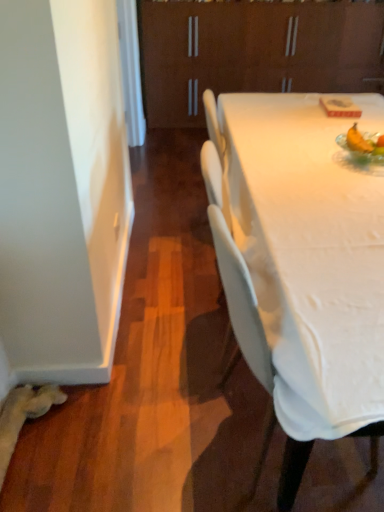
Question: From a real-world perspective, is brown matte cabinet at upper center above or below translucent glass bowl at upper right?

Choices:
 (A) below
 (B) above

Answer: (A)

Question: Is brown matte cabinet at upper center in front of or behind translucent glass bowl at upper right in the image?

Choices:
 (A) front
 (B) behind

Answer: (B)

Question: Estimate the real-world distances between objects in this image. Which object is closer to the translucent glass bowl at upper right?

Choices:
 (A) white plastic chair at center
 (B) brown matte cabinet at upper center

Answer: (A)

Question: Which of these objects is positioned closest to the translucent glass bowl at upper right?

Choices:
 (A) white plastic chair at center
 (B) brown matte cabinet at upper center

Answer: (A)